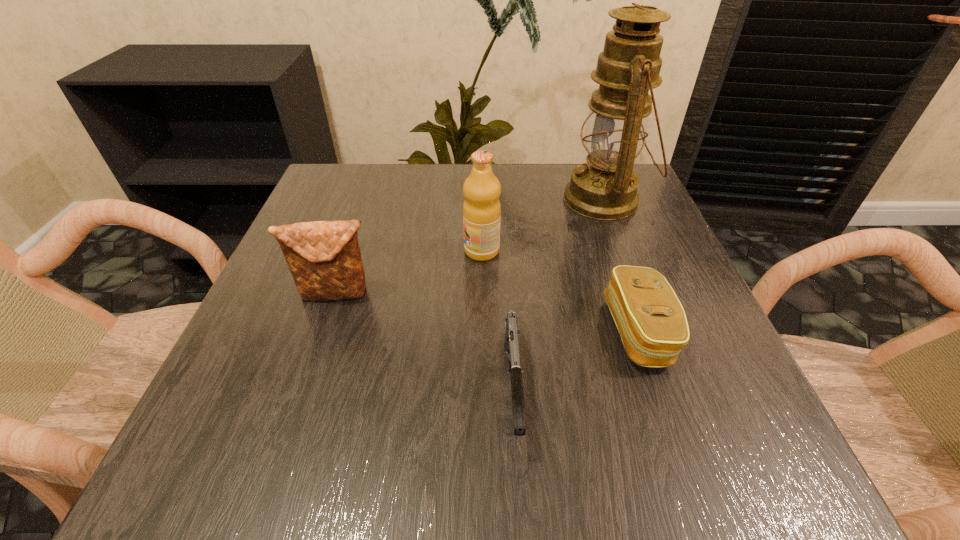
The width and height of the screenshot is (960, 540). What are the coordinates of `clutch bag situated at the right edge` in the screenshot? It's located at (651, 321).

You are a GUI agent. You are given a task and a screenshot of the screen. Output one action in this format:
    pyautogui.click(x=<x>, y=<y>)
    Task: Click on the object that is at the far right corner
    This screenshot has height=540, width=960.
    Given the screenshot: What is the action you would take?
    pyautogui.click(x=604, y=188)

This screenshot has height=540, width=960. Find the location of `free region at the far edge of the desktop`. free region at the far edge of the desktop is located at coordinates (458, 181).

The image size is (960, 540). I want to click on free space at the near edge of the desktop, so click(494, 435).

In the image, there is a desktop. Where is `vacant space at the left edge`? The height and width of the screenshot is (540, 960). vacant space at the left edge is located at coordinates (287, 352).

What are the coordinates of `free space at the right edge` in the screenshot? It's located at (663, 389).

This screenshot has height=540, width=960. Find the location of `empty location between the shorter clutch bag and the gun`. empty location between the shorter clutch bag and the gun is located at coordinates (576, 360).

Locate an element on the screen. free space that is in between the gun and the farthest object is located at coordinates (559, 294).

The height and width of the screenshot is (540, 960). What are the coordinates of `free space between the fruit juice and the right clutch bag` in the screenshot? It's located at (560, 291).

This screenshot has width=960, height=540. In order to click on empty space that is in between the left clutch bag and the right clutch bag in this screenshot , I will do `click(488, 313)`.